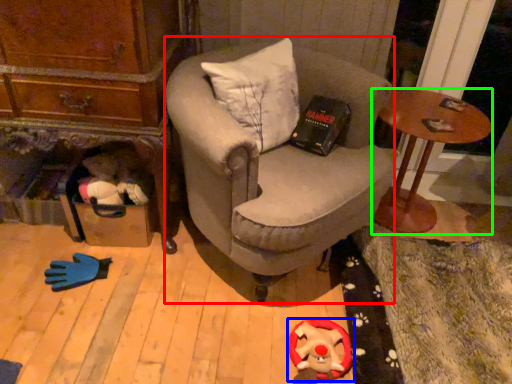
Question: Which object is positioned closest to chair (highlighted by a red box)? Select from toy (highlighted by a blue box) and desk (highlighted by a green box).

Choices:
 (A) toy
 (B) desk

Answer: (B)